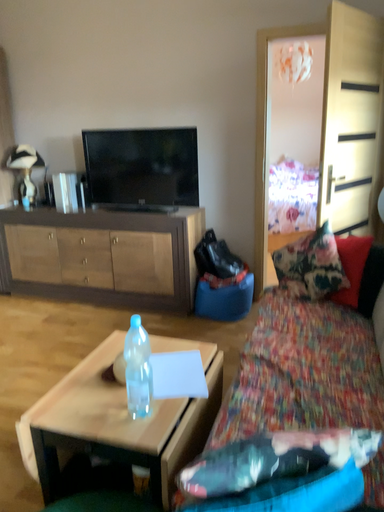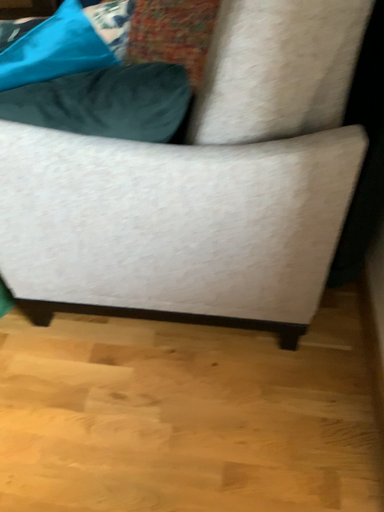
Question: How did the camera likely rotate when shooting the video?

Choices:
 (A) rotated downward
 (B) rotated upward

Answer: (A)